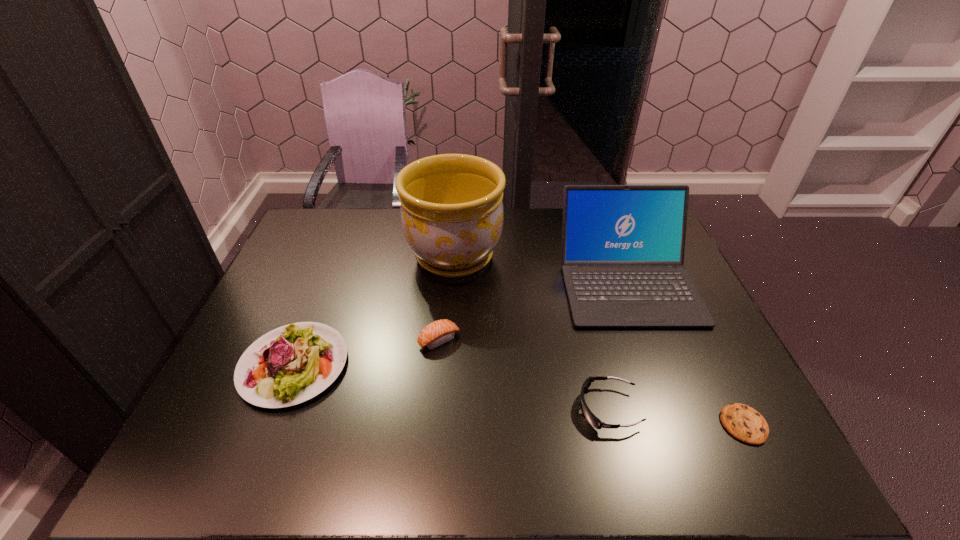
Locate an element on the screen. free space located 0.060m on the right of the sushi is located at coordinates (482, 340).

At what (x,y) coordinates should I click in order to perform the action: click on free space located on the front and sides of the goggles. Please return your answer as a coordinate pair (x, y). Image resolution: width=960 pixels, height=540 pixels. Looking at the image, I should click on (488, 408).

Image resolution: width=960 pixels, height=540 pixels. In order to click on vacant space positioned on the front and sides of the goggles in this screenshot , I will do `click(557, 408)`.

Identify the location of vacant space located on the front and sides of the goggles. Image resolution: width=960 pixels, height=540 pixels. (496, 408).

Identify the location of free space located 0.240m on the left of the shortest object. Image resolution: width=960 pixels, height=540 pixels. (615, 424).

This screenshot has width=960, height=540. Identify the location of flowerpot at the far edge. (452, 215).

The image size is (960, 540). In order to click on laptop computer located at the far edge in this screenshot , I will do `click(623, 246)`.

Identify the location of object located in the near edge section of the desktop. This screenshot has width=960, height=540. (744, 423).

Where is `object present at the left edge`? object present at the left edge is located at coordinates (291, 364).

Where is `laptop computer present at the right edge`? The height and width of the screenshot is (540, 960). laptop computer present at the right edge is located at coordinates (623, 246).